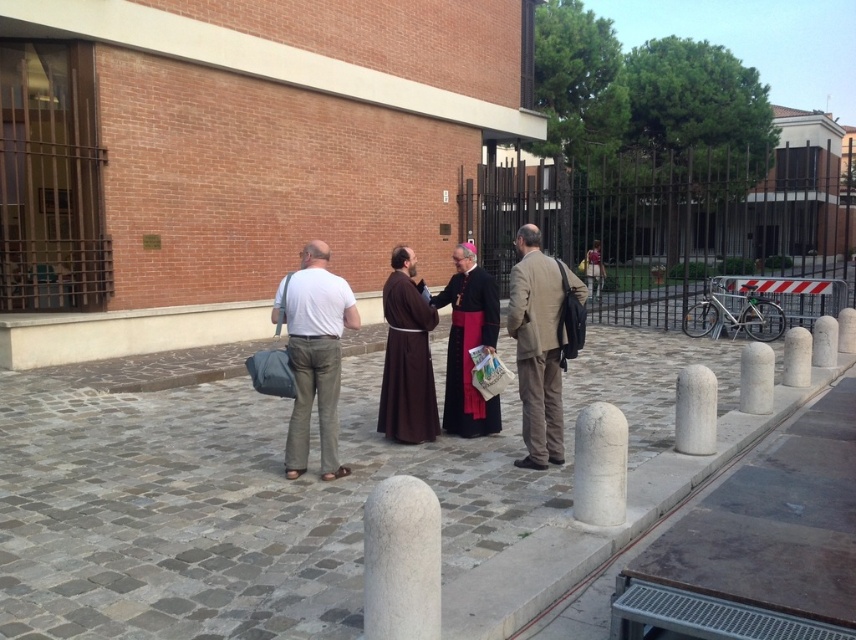
Consider the image. You are standing at the point with coordinates (221, 509) in the image. What is the object located at that exact point?

The object located at point (221, 509) is the gray cobblestone pavement at center.

You are standing at the point marked as point [395,540] in the image. You want to cross the road to the other side. The road is 5 meters wide. Can you reach the other side without moving from your current position?

The distance between you and the viewer is 2.87 meters, which is less than the 5 meter width of the road. Therefore, you cannot reach the other side without moving from your current position.

You are a delivery person who needs to place a package on the gray cobblestone pavement at center. However, there is a black velvet robe at center in the way. Can you place the package directly on the pavement without moving the robe?

The gray cobblestone pavement at center is in front of the black velvet robe at center, meaning the robe is behind the pavement from your perspective. Therefore, you can place the package directly on the gray cobblestone pavement at center without needing to move the robe.